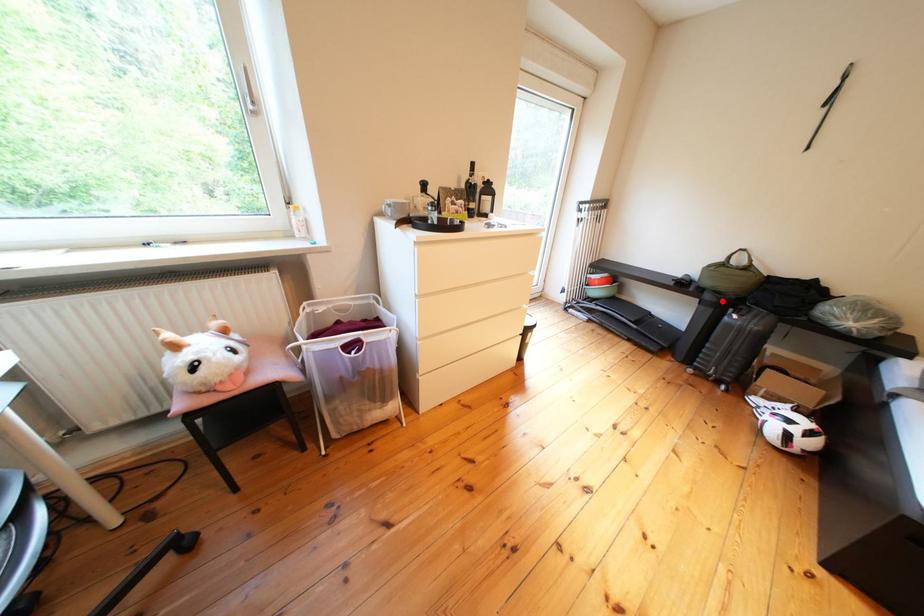
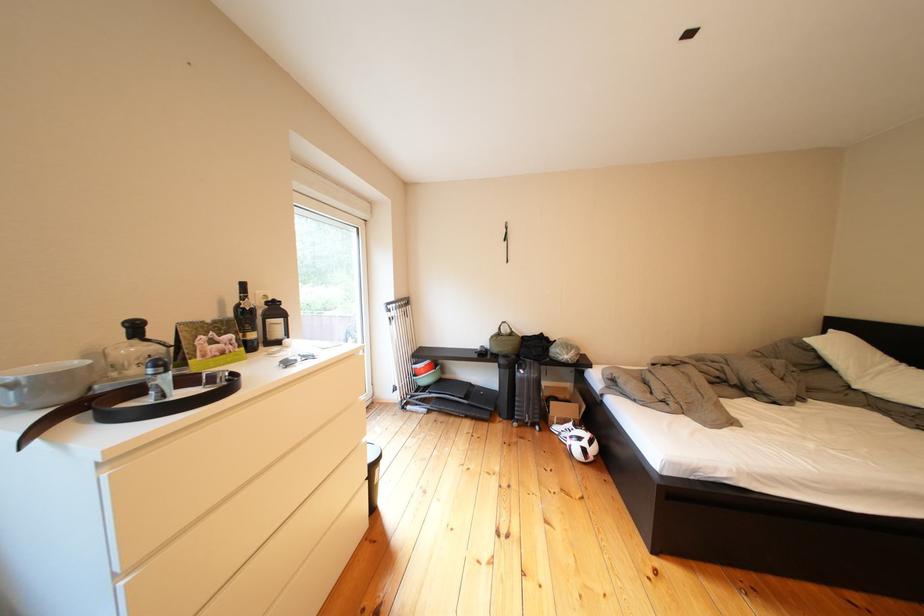
Where in the second image is the point corresponding to the highlighted location from the first image?

(516, 366)